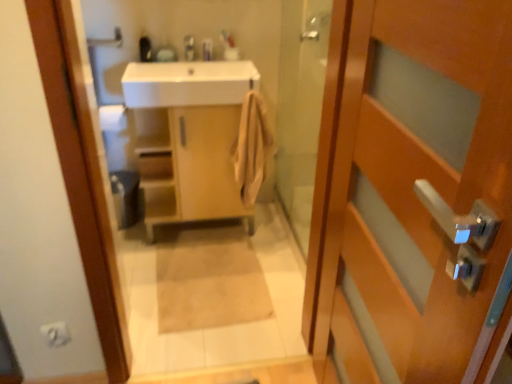
The height and width of the screenshot is (384, 512). Identify the location of free spot above white glossy sink at upper center (from a real-world perspective). (202, 69).